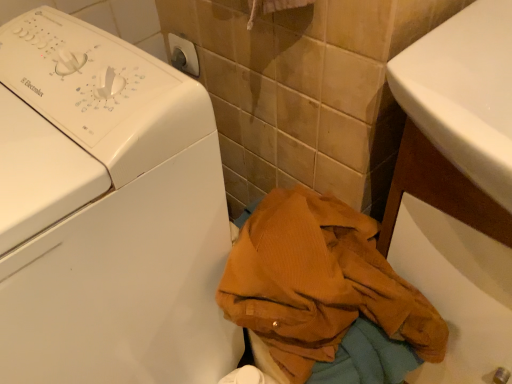
Question: From the image's perspective, is corduroy fabric jacket at lower right above or below white plastic washing machine at lower left?

Choices:
 (A) below
 (B) above

Answer: (A)

Question: Is corduroy fabric jacket at lower right taller or shorter than white plastic washing machine at lower left?

Choices:
 (A) tall
 (B) short

Answer: (B)

Question: From a real-world perspective, is corduroy fabric jacket at lower right physically located above or below white plastic washing machine at lower left?

Choices:
 (A) above
 (B) below

Answer: (B)

Question: Is point (44, 76) closer or farther from the camera than point (423, 299)?

Choices:
 (A) closer
 (B) farther

Answer: (A)

Question: Looking at their shapes, would you say white plastic washing machine at lower left is wider or thinner than corduroy fabric jacket at lower right?

Choices:
 (A) thin
 (B) wide

Answer: (B)

Question: In terms of height, does white plastic washing machine at lower left look taller or shorter compared to corduroy fabric jacket at lower right?

Choices:
 (A) tall
 (B) short

Answer: (A)

Question: Which is correct: white plastic washing machine at lower left is inside corduroy fabric jacket at lower right, or outside of it?

Choices:
 (A) outside
 (B) inside

Answer: (A)